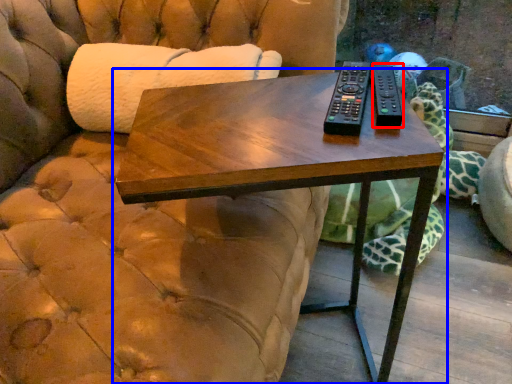
Question: Which object appears closest to the camera in this image, remote (highlighted by a red box) or table (highlighted by a blue box)?

Choices:
 (A) remote
 (B) table

Answer: (B)